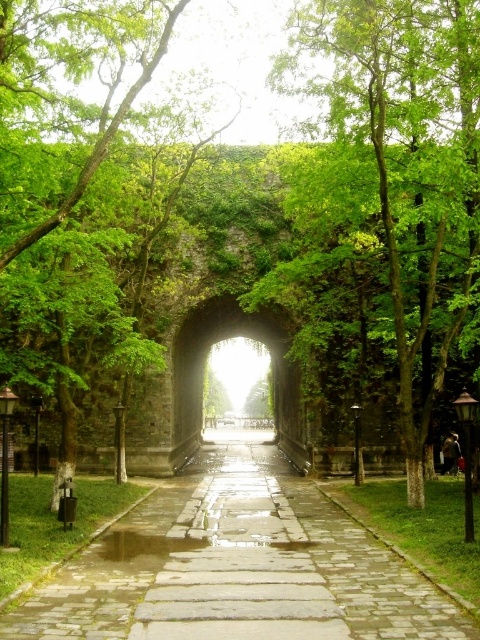
Question: From the image, what is the correct spatial relationship of green leafy tree at center in relation to green stone archway at center?

Choices:
 (A) above
 (B) below

Answer: (A)

Question: Where is stone paved path at center located in relation to green stone archway at center in the image?

Choices:
 (A) left
 (B) right

Answer: (B)

Question: Can you confirm if green leafy tree at center is positioned to the left of paved stone path at center?

Choices:
 (A) yes
 (B) no

Answer: (B)

Question: Which object is the farthest from the green stone archway at center?

Choices:
 (A) green leafy tree at center
 (B) stone paved path at center
 (C) paved stone path at center

Answer: (A)

Question: Which object is positioned closest to the stone paved path at center?

Choices:
 (A) green leafy tree at center
 (B) paved stone path at center

Answer: (B)

Question: Based on their relative distances, which object is farther from the green leafy tree at center?

Choices:
 (A) green stone archway at center
 (B) stone paved path at center
 (C) paved stone path at center

Answer: (B)